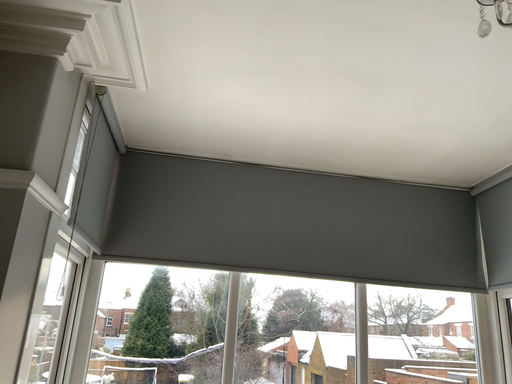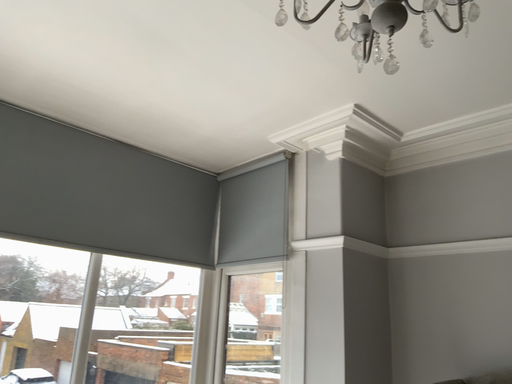
Question: Which way did the camera rotate in the video?

Choices:
 (A) rotated left
 (B) rotated right

Answer: (B)